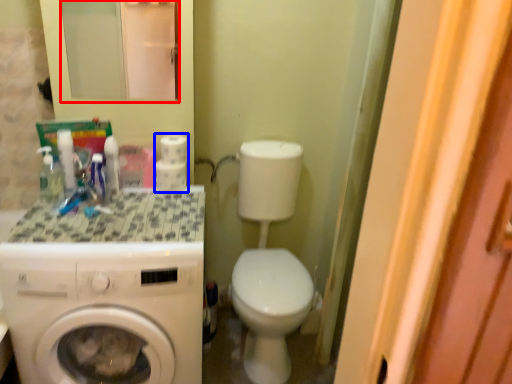
Question: Among these objects, which one is nearest to the camera, mirror (highlighted by a red box) or toilet paper (highlighted by a blue box)?

Choices:
 (A) mirror
 (B) toilet paper

Answer: (A)